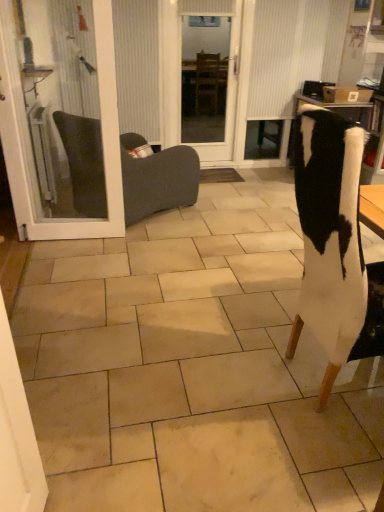
Find the location of a particular element. This screenshot has width=384, height=512. unoccupied area in front of white glass door at left is located at coordinates (69, 262).